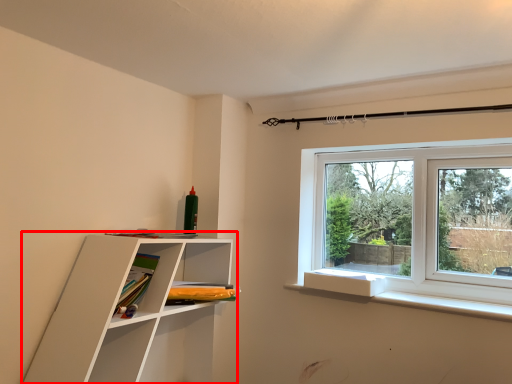
Question: From the image's perspective, where is shelf (annotated by the red box) located in relation to book in the image?

Choices:
 (A) above
 (B) below

Answer: (B)